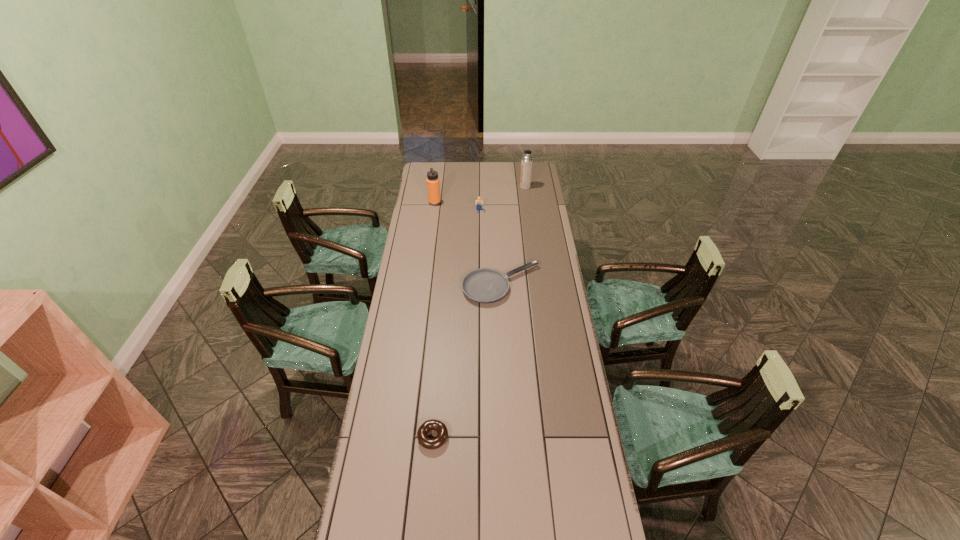
Find the location of a particular element. free space located on the right of the nearer thermos bottle is located at coordinates (504, 202).

Locate an element on the screen. vacant space situated on the face of the Lego is located at coordinates (479, 230).

At what (x,y) coordinates should I click in order to perform the action: click on free space located 0.160m on the left of the doughnut. Please return your answer as a coordinate pair (x, y). Looking at the image, I should click on (371, 437).

Locate an element on the screen. free spot located 0.160m on the front of the second nearest object is located at coordinates (504, 335).

What are the coordinates of `object that is at the left edge` in the screenshot? It's located at (433, 185).

This screenshot has width=960, height=540. What are the coordinates of `thermos bottle located in the right edge section of the desktop` in the screenshot? It's located at (527, 161).

Find the location of `frying pan at the right edge`. frying pan at the right edge is located at coordinates coord(485,285).

In order to click on vacant area at the far edge of the desktop in this screenshot , I will do `click(494, 179)`.

The height and width of the screenshot is (540, 960). Identify the location of vacant space at the left edge of the desktop. (433, 281).

Where is `vacant region at the right edge of the desktop`? vacant region at the right edge of the desktop is located at coordinates (553, 234).